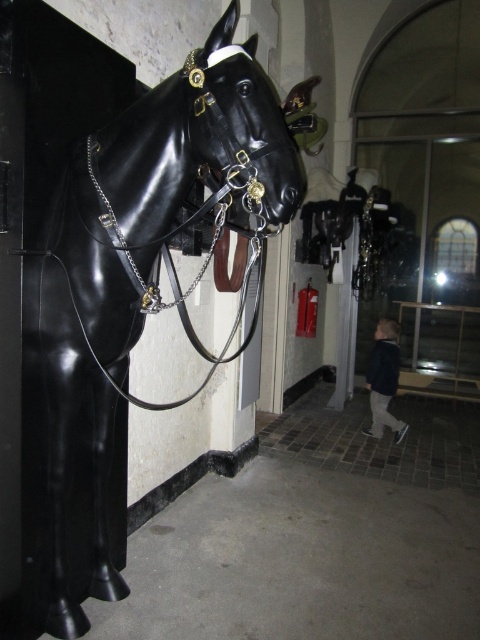
Looking at this image, between glossy black horse at left and glossy black horse head at center, which one is positioned lower?

glossy black horse head at center is lower down.

Is the position of glossy black horse at left less distant than that of glossy black horse head at center?

Yes, glossy black horse at left is closer to the viewer.

Identify the location of glossy black horse at left. (130, 292).

Who is shorter, black leather bridle at center or dark blue jacket at lower right?

black leather bridle at center is shorter.

Is black leather bridle at center wider than dark blue jacket at lower right?

Yes, black leather bridle at center is wider than dark blue jacket at lower right.

Identify the location of black leather bridle at center. The height and width of the screenshot is (640, 480). (243, 131).

The height and width of the screenshot is (640, 480). Identify the location of black leather bridle at center. (243, 131).

Is glossy black horse at left wider than dark blue jacket at lower right?

Indeed, glossy black horse at left has a greater width compared to dark blue jacket at lower right.

Who is more distant from viewer, (237,323) or (396,333)?

Positioned behind is point (396,333).

You are a GUI agent. You are given a task and a screenshot of the screen. Output one action in this format:
    pyautogui.click(x=<x>, y=<y>)
    Task: Click on the glossy black horse at left
    Image resolution: width=480 pixels, height=640 pixels.
    Given the screenshot: What is the action you would take?
    pyautogui.click(x=130, y=292)